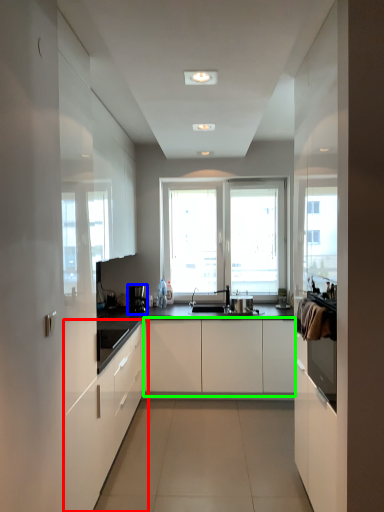
Question: Which is nearer to the cabinetry (highlighted by a red box)? coffee machine (highlighted by a blue box) or cabinetry (highlighted by a green box).

Choices:
 (A) coffee machine
 (B) cabinetry

Answer: (B)